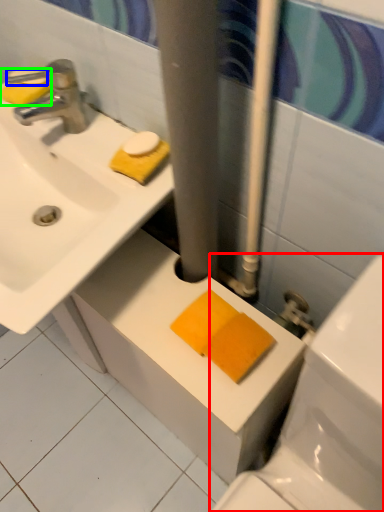
Question: Considering the real-world distances, which object is closest to toilet (highlighted by a red box)? soap (highlighted by a blue box) or soap (highlighted by a green box).

Choices:
 (A) soap
 (B) soap

Answer: (B)